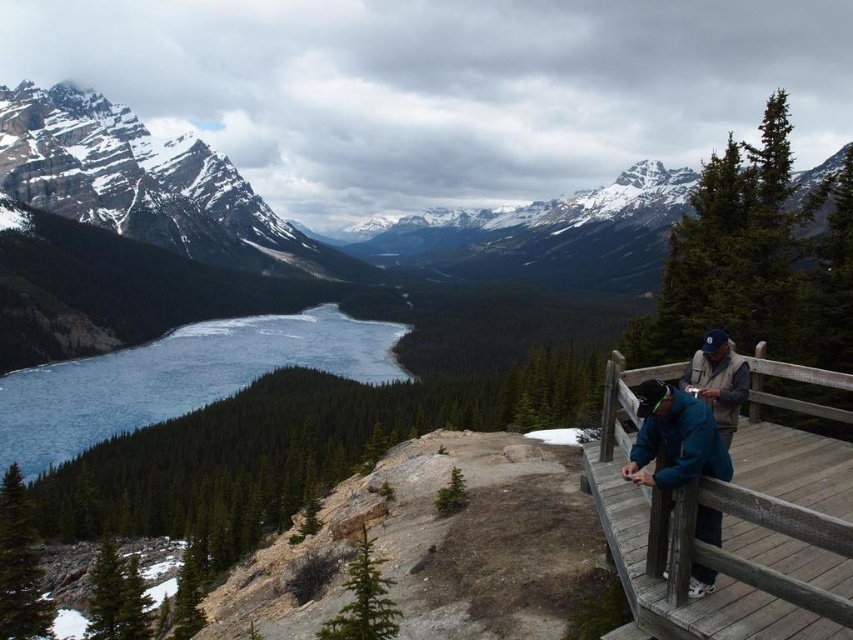
You are standing on the wooden platform overlooking the mountainous landscape. There are two points marked in the scene. Which point is closer to you, point [682,516] or point [729,416]?

Point [682,516] is closer to the viewer than point [729,416].

You are a hiker who needs to place a 5 meter long rope between the wooden at right and the blue fabric jacket at right. Will the rope be long enough?

The wooden at right is 4.80 meters from blue fabric jacket at right, so the 5 meter long rope will be long enough to place between them.

You are a photographer planning to take a photo of the blue ice at lower left and the blue fabric jacket at right. Which object should you focus on first if you want to capture both in the same frame without moving the camera?

The blue ice at lower left is much taller than the blue fabric jacket at right, so you should focus on the blue ice at lower left first to ensure it fits within the frame.